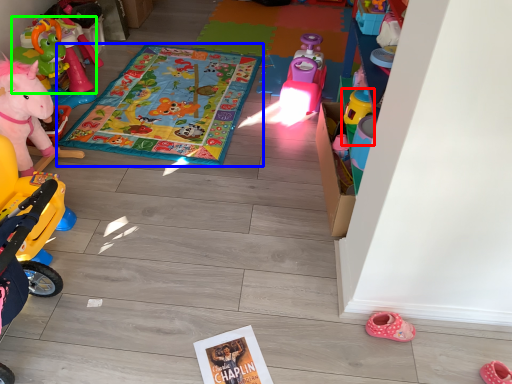
Question: Which is farther away from toy (highlighted by a red box)? blanket (highlighted by a blue box) or toy (highlighted by a green box)?

Choices:
 (A) blanket
 (B) toy

Answer: (B)